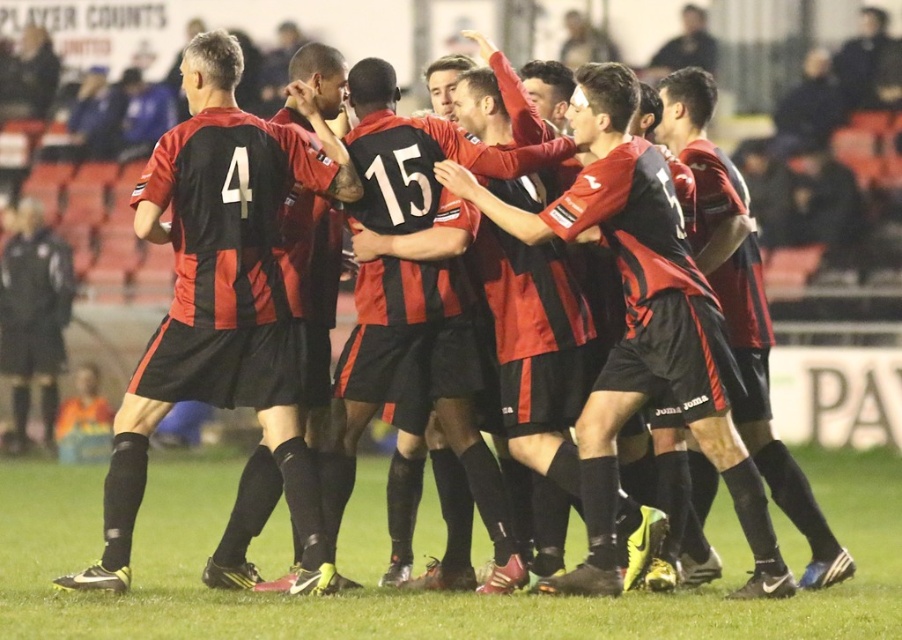
Question: Is green grass at center below matte jersey at left?

Choices:
 (A) no
 (B) yes

Answer: (B)

Question: Is green grass at center below matte jersey at left?

Choices:
 (A) yes
 (B) no

Answer: (A)

Question: Can you confirm if green grass at center is positioned to the left of matte jersey at left?

Choices:
 (A) no
 (B) yes

Answer: (A)

Question: Which point appears closest to the camera in this image?

Choices:
 (A) (311, 604)
 (B) (164, 410)

Answer: (A)

Question: Which object is farther from the camera taking this photo?

Choices:
 (A) matte jersey at left
 (B) green grass at center

Answer: (A)

Question: Which object is farther from the camera taking this photo?

Choices:
 (A) matte jersey at left
 (B) green grass at center

Answer: (A)